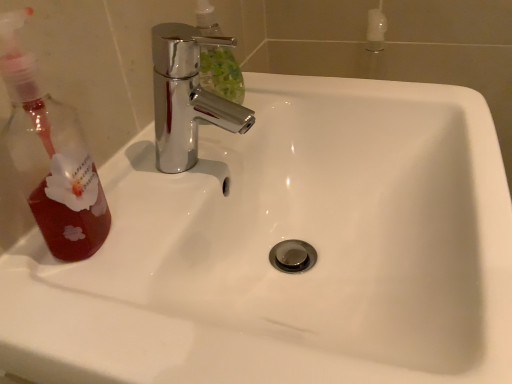
Question: Should I look upward or downward to see translucent red liquid at left?

Choices:
 (A) down
 (B) up

Answer: (B)

Question: From a real-world perspective, is translucent red liquid at left over chrome metallic faucet at upper center?

Choices:
 (A) yes
 (B) no

Answer: (A)

Question: Is translucent red liquid at left in front of chrome metallic faucet at upper center?

Choices:
 (A) no
 (B) yes

Answer: (B)

Question: Is translucent red liquid at left to the left of chrome metallic faucet at upper center from the viewer's perspective?

Choices:
 (A) yes
 (B) no

Answer: (A)

Question: Can you confirm if translucent red liquid at left is taller than chrome metallic faucet at upper center?

Choices:
 (A) yes
 (B) no

Answer: (A)

Question: Is translucent red liquid at left not near chrome metallic faucet at upper center?

Choices:
 (A) no
 (B) yes

Answer: (A)

Question: Considering the relative sizes of translucent red liquid at left and chrome metallic faucet at upper center in the image provided, is translucent red liquid at left shorter than chrome metallic faucet at upper center?

Choices:
 (A) yes
 (B) no

Answer: (B)

Question: Does chrome metallic faucet at upper center lie in front of translucent red liquid at left?

Choices:
 (A) no
 (B) yes

Answer: (A)

Question: Does chrome metallic faucet at upper center appear on the right side of translucent red liquid at left?

Choices:
 (A) no
 (B) yes

Answer: (B)

Question: Can you confirm if chrome metallic faucet at upper center is smaller than translucent red liquid at left?

Choices:
 (A) yes
 (B) no

Answer: (B)

Question: Is chrome metallic faucet at upper center shorter than translucent red liquid at left?

Choices:
 (A) no
 (B) yes

Answer: (B)

Question: From the image's perspective, is chrome metallic faucet at upper center located above translucent red liquid at left?

Choices:
 (A) yes
 (B) no

Answer: (A)

Question: From the image's perspective, would you say chrome metallic faucet at upper center is shown under translucent red liquid at left?

Choices:
 (A) no
 (B) yes

Answer: (A)

Question: From the image's perspective, is translucent red liquid at left located above or below chrome metallic faucet at upper center?

Choices:
 (A) below
 (B) above

Answer: (A)